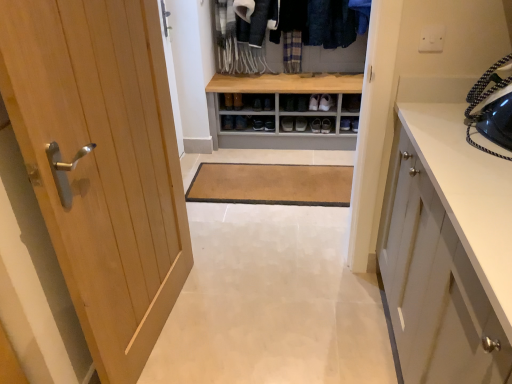
Question: Can you confirm if dark blue woolen sweater at upper center is taller than light wood door at left?

Choices:
 (A) no
 (B) yes

Answer: (A)

Question: Can you confirm if dark blue woolen sweater at upper center is thinner than light wood door at left?

Choices:
 (A) no
 (B) yes

Answer: (A)

Question: Could you tell me if dark blue woolen sweater at upper center is turned towards light wood door at left?

Choices:
 (A) no
 (B) yes

Answer: (B)

Question: Is dark blue woolen sweater at upper center bigger than light wood door at left?

Choices:
 (A) no
 (B) yes

Answer: (A)

Question: From a real-world perspective, is dark blue woolen sweater at upper center located beneath light wood door at left?

Choices:
 (A) yes
 (B) no

Answer: (B)

Question: Does point coord(287,125) appear closer or farther from the camera than point coord(437,44)?

Choices:
 (A) farther
 (B) closer

Answer: (A)

Question: In terms of width, does matte black shoe at center, the 1th footwear viewed from the left, look wider or thinner when compared to white plastic electric outlet at upper center?

Choices:
 (A) thin
 (B) wide

Answer: (B)

Question: From the image's perspective, is matte black shoe at center, which appears as the 3th footwear when viewed from the right, located above or below white plastic electric outlet at upper center?

Choices:
 (A) above
 (B) below

Answer: (B)

Question: Based on their positions, is matte black shoe at center, which appears as the 3th footwear when viewed from the right, located to the left or right of white plastic electric outlet at upper center?

Choices:
 (A) left
 (B) right

Answer: (A)

Question: Looking at the image, does white glossy cabinet at right seem bigger or smaller compared to brown leather shoe at center, acting as the 2th shoe starting from the bottom?

Choices:
 (A) big
 (B) small

Answer: (A)

Question: Is white glossy cabinet at right in front of or behind brown leather shoe at center, acting as the 2th shoe starting from the bottom, in the image?

Choices:
 (A) behind
 (B) front

Answer: (B)

Question: In the image, is white glossy cabinet at right on the left side or the right side of brown leather shoe at center, the 1th shoe in the right-to-left sequence?

Choices:
 (A) left
 (B) right

Answer: (B)

Question: From their relative heights in the image, would you say white glossy cabinet at right is taller or shorter than brown leather shoe at center, the 1th shoe in the right-to-left sequence?

Choices:
 (A) tall
 (B) short

Answer: (A)

Question: Is white plastic electric outlet at upper center in front of or behind matte black shoe at center, the 1th footwear viewed from the left, in the image?

Choices:
 (A) front
 (B) behind

Answer: (A)

Question: Considering the positions of white plastic electric outlet at upper center and matte black shoe at center, the 1th footwear viewed from the left, in the image, is white plastic electric outlet at upper center bigger or smaller than matte black shoe at center, the 1th footwear viewed from the left,?

Choices:
 (A) big
 (B) small

Answer: (B)